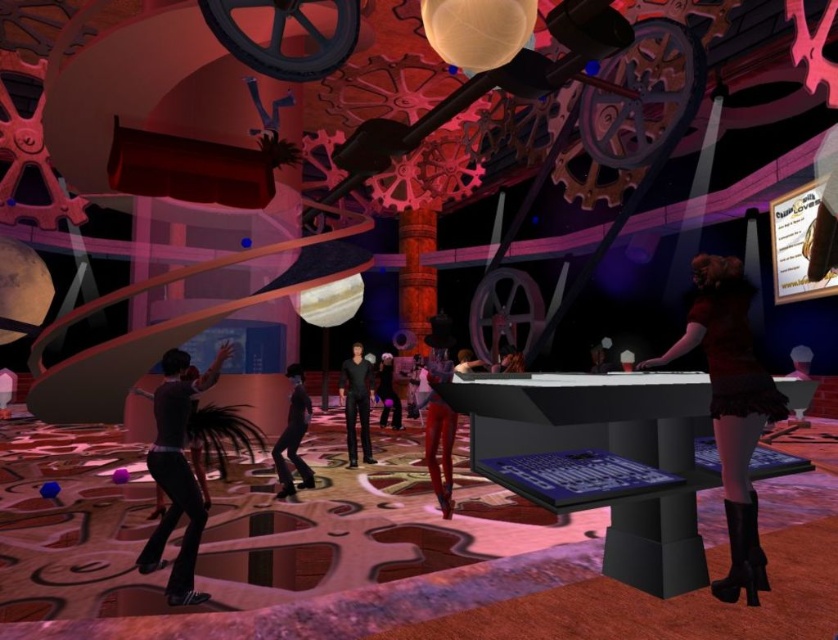
Question: Can you confirm if shiny red pants at center is thinner than shiny black pants at center?

Choices:
 (A) yes
 (B) no

Answer: (A)

Question: Is velvet red dress at right to the left of shiny black jacket at center from the viewer's perspective?

Choices:
 (A) no
 (B) yes

Answer: (A)

Question: Does shiny black pants at center have a smaller size compared to matte black suit at center?

Choices:
 (A) yes
 (B) no

Answer: (A)

Question: Estimate the real-world distances between objects in this image. Which object is closer to the shiny black suit at center left?

Choices:
 (A) velvet red dress at right
 (B) shiny black pants at center

Answer: (B)

Question: Which object appears closest to the camera in this image?

Choices:
 (A) velvet red dress at right
 (B) matte black suit at center
 (C) shiny red pants at center

Answer: (A)

Question: Among these points, which one is nearest to the camera?

Choices:
 (A) (350, 372)
 (B) (194, 381)
 (C) (383, 371)
 (D) (438, 467)

Answer: (B)